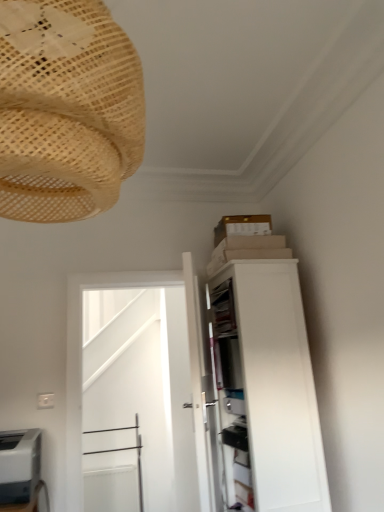
Question: Are gray matte printer at lower left and white glossy door at center located far from each other?

Choices:
 (A) yes
 (B) no

Answer: (A)

Question: Is gray matte printer at lower left wider than white glossy door at center?

Choices:
 (A) yes
 (B) no

Answer: (A)

Question: From a real-world perspective, is gray matte printer at lower left positioned under white glossy door at center based on gravity?

Choices:
 (A) no
 (B) yes

Answer: (B)

Question: Can you confirm if gray matte printer at lower left is taller than white glossy door at center?

Choices:
 (A) yes
 (B) no

Answer: (B)

Question: From the image's perspective, is gray matte printer at lower left located beneath white glossy door at center?

Choices:
 (A) no
 (B) yes

Answer: (B)

Question: Is gray matte printer at lower left positioned beyond the bounds of white glossy door at center?

Choices:
 (A) yes
 (B) no

Answer: (A)

Question: Is gray matte printer at lower left located within natural woven lampshade at upper left?

Choices:
 (A) yes
 (B) no

Answer: (B)

Question: Would you say natural woven lampshade at upper left is a long distance from gray matte printer at lower left?

Choices:
 (A) no
 (B) yes

Answer: (B)

Question: Does natural woven lampshade at upper left come behind gray matte printer at lower left?

Choices:
 (A) yes
 (B) no

Answer: (B)

Question: Is natural woven lampshade at upper left located outside gray matte printer at lower left?

Choices:
 (A) no
 (B) yes

Answer: (B)

Question: Is natural woven lampshade at upper left aimed at gray matte printer at lower left?

Choices:
 (A) yes
 (B) no

Answer: (B)

Question: From a real-world perspective, is natural woven lampshade at upper left positioned over gray matte printer at lower left based on gravity?

Choices:
 (A) yes
 (B) no

Answer: (A)

Question: Does white glossy door at center appear on the left side of natural woven lampshade at upper left?

Choices:
 (A) no
 (B) yes

Answer: (A)